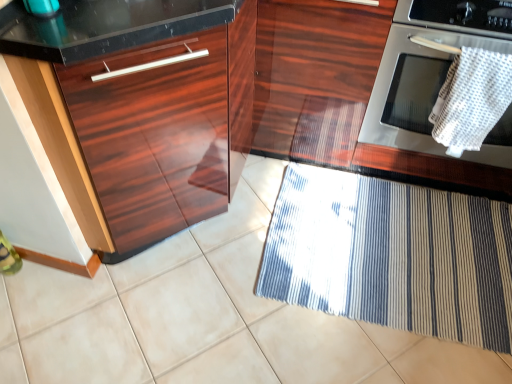
What are the coordinates of `free space that is to the left of blue striped mat at lower right` in the screenshot? It's located at (219, 280).